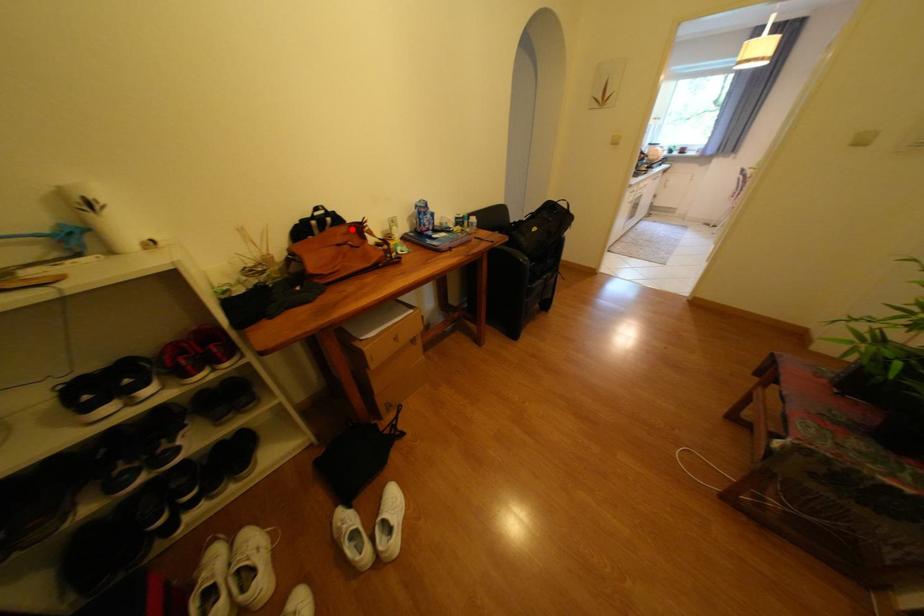
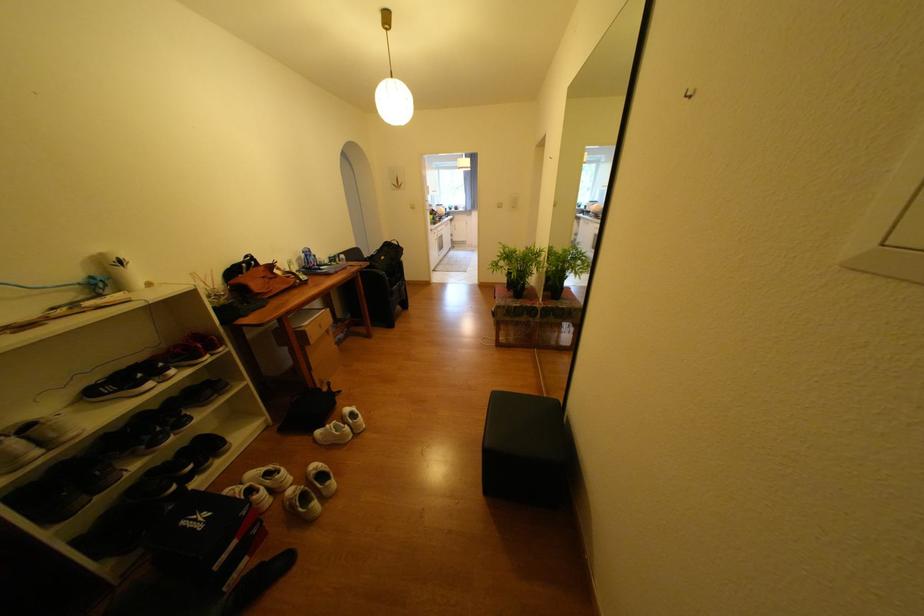
Where in the second image is the point corresponding to the highlighted location from the first image?

(271, 269)